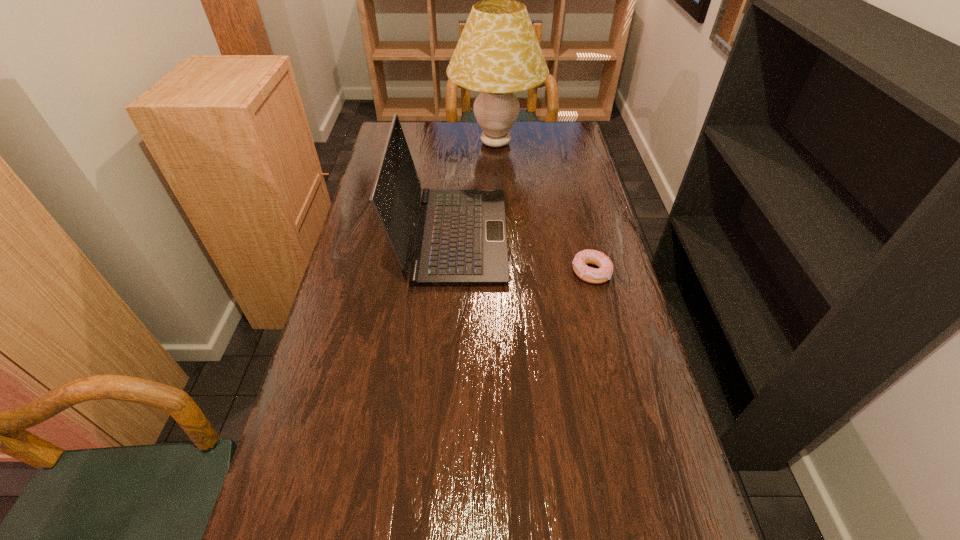
Where is `empty location between the laptop computer and the tallest object`? empty location between the laptop computer and the tallest object is located at coordinates (474, 190).

Locate an element on the screen. This screenshot has height=540, width=960. free space between the doughnut and the lampshade is located at coordinates (543, 207).

This screenshot has height=540, width=960. In order to click on empty space between the tallest object and the second tallest object in this screenshot , I will do `click(474, 190)`.

At what (x,y) coordinates should I click in order to perform the action: click on vacant space that's between the rightmost object and the farthest object. Please return your answer as a coordinate pair (x, y). This screenshot has width=960, height=540. Looking at the image, I should click on (543, 207).

The height and width of the screenshot is (540, 960). What are the coordinates of `object that ranks as the closest to the farthest object` in the screenshot? It's located at (461, 239).

You are a GUI agent. You are given a task and a screenshot of the screen. Output one action in this format:
    pyautogui.click(x=<x>, y=<y>)
    Task: Click on the object identified as the second closest to the lampshade
    Image resolution: width=960 pixels, height=540 pixels.
    Given the screenshot: What is the action you would take?
    [602, 274]

The image size is (960, 540). What are the coordinates of `free spot that satisfies the following two spatial constraints: 1. on the screen of the doughnut; 2. on the left side of the second tallest object` in the screenshot? It's located at (449, 272).

At what (x,y) coordinates should I click in order to perform the action: click on vacant point that satisfies the following two spatial constraints: 1. on the front side of the tallest object; 2. on the right side of the doughnut. Please return your answer as a coordinate pair (x, y). The height and width of the screenshot is (540, 960). Looking at the image, I should click on (502, 272).

The width and height of the screenshot is (960, 540). I want to click on free location that satisfies the following two spatial constraints: 1. on the back side of the shortest object; 2. on the screen of the laptop computer, so click(x=583, y=236).